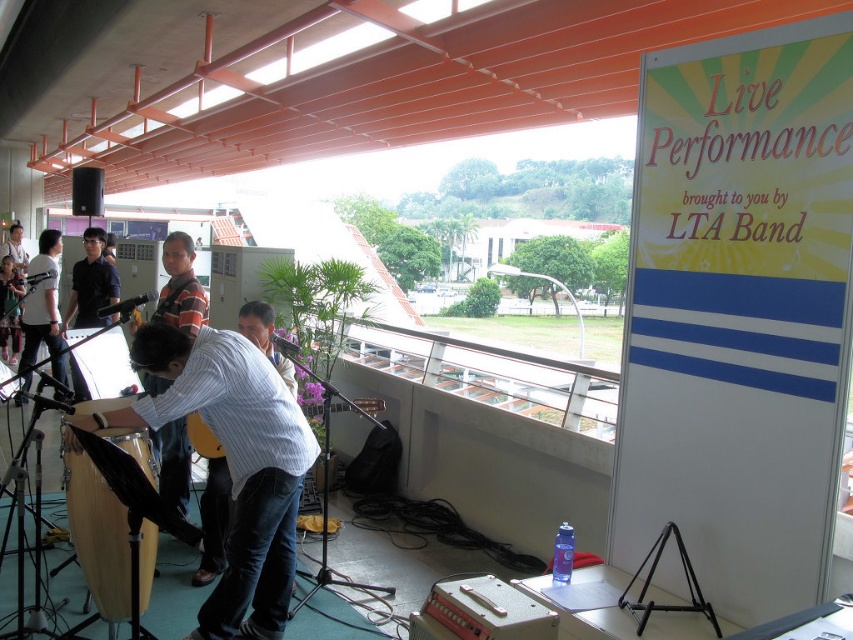
Question: Can you confirm if matte white shirt at left is positioned below light brown leather guitar at center?

Choices:
 (A) no
 (B) yes

Answer: (B)

Question: Which object is positioned farthest from the blue striped shirt at center?

Choices:
 (A) striped cotton shirt at center
 (B) matte white shirt at left

Answer: (B)

Question: Estimate the real-world distances between objects in this image. Which object is farther from the wooden drum at center?

Choices:
 (A) striped cotton shirt at center
 (B) blue striped shirt at center
 (C) matte white shirt at left
 (D) light brown leather guitar at center

Answer: (D)

Question: Is blue striped shirt at center bigger than light brown leather guitar at center?

Choices:
 (A) yes
 (B) no

Answer: (B)

Question: Which of the following is the closest to the observer?

Choices:
 (A) click(x=175, y=264)
 (B) click(x=36, y=346)

Answer: (A)

Question: Can you confirm if wooden drum at lower left is thinner than light brown leather guitar at center?

Choices:
 (A) yes
 (B) no

Answer: (A)